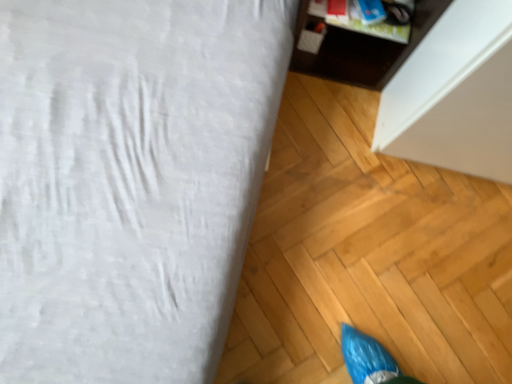
What do you see at coordinates (361, 48) in the screenshot? I see `dark wood cabinet at upper right, the 2th furniture when ordered from left to right` at bounding box center [361, 48].

From the picture: In order to face dark wood cabinet at upper right, which is the first furniture from right to left, should I rotate leftwards or rightwards?

It's best to rotate right around 14.298 degrees.

The image size is (512, 384). I want to click on dark wood cabinet at upper right, which is the first furniture from right to left, so click(x=361, y=48).

You are a GUI agent. You are given a task and a screenshot of the screen. Output one action in this format:
    pyautogui.click(x=<x>, y=<y>)
    Task: Click on the white fabric bed at upper left, the first furniture positioned from the left
    
    Given the screenshot: What is the action you would take?
    pyautogui.click(x=130, y=181)

What is the approximate height of white fabric bed at upper left, the first furniture positioned from the left?

10.29 inches.

The image size is (512, 384). What do you see at coordinates (130, 181) in the screenshot? I see `white fabric bed at upper left, which appears as the 2th furniture when viewed from the right` at bounding box center [130, 181].

How much space does white fabric bed at upper left, which appears as the 2th furniture when viewed from the right, occupy horizontally?

36.90 inches.

Where is `dark wood cabinet at upper right, which is the first furniture from right to left`? dark wood cabinet at upper right, which is the first furniture from right to left is located at coordinates (361, 48).

Is white fabric bed at upper left, which appears as the 2th furniture when viewed from the right, to the left or to the right of dark wood cabinet at upper right, which is the first furniture from right to left, in the image?

Based on their positions, white fabric bed at upper left, which appears as the 2th furniture when viewed from the right, is located to the left of dark wood cabinet at upper right, which is the first furniture from right to left.

Is the position of white fabric bed at upper left, which appears as the 2th furniture when viewed from the right, more distant than that of dark wood cabinet at upper right, the 2th furniture when ordered from left to right?

No, white fabric bed at upper left, which appears as the 2th furniture when viewed from the right, is in front of dark wood cabinet at upper right, the 2th furniture when ordered from left to right.

Considering the positions of point (179, 55) and point (348, 45), is point (179, 55) closer or farther from the camera than point (348, 45)?

Point (179, 55).

From the image's perspective, is white fabric bed at upper left, the first furniture positioned from the left, located above dark wood cabinet at upper right, which is the first furniture from right to left?

Actually, white fabric bed at upper left, the first furniture positioned from the left, appears below dark wood cabinet at upper right, which is the first furniture from right to left, in the image.

From a real-world perspective, is white fabric bed at upper left, which appears as the 2th furniture when viewed from the right, positioned under dark wood cabinet at upper right, which is the first furniture from right to left, based on gravity?

Yes, from a real-world perspective, white fabric bed at upper left, which appears as the 2th furniture when viewed from the right, is beneath dark wood cabinet at upper right, which is the first furniture from right to left.

Can you confirm if white fabric bed at upper left, the first furniture positioned from the left, is wider than dark wood cabinet at upper right, the 2th furniture when ordered from left to right?

Yes, white fabric bed at upper left, the first furniture positioned from the left, is wider than dark wood cabinet at upper right, the 2th furniture when ordered from left to right.

Is white fabric bed at upper left, which appears as the 2th furniture when viewed from the right, taller than dark wood cabinet at upper right, which is the first furniture from right to left?

No.

Between white fabric bed at upper left, which appears as the 2th furniture when viewed from the right, and dark wood cabinet at upper right, the 2th furniture when ordered from left to right, which one has larger size?

white fabric bed at upper left, which appears as the 2th furniture when viewed from the right.

Is white fabric bed at upper left, which appears as the 2th furniture when viewed from the right, outside of dark wood cabinet at upper right, which is the first furniture from right to left?

Indeed, white fabric bed at upper left, which appears as the 2th furniture when viewed from the right, is completely outside dark wood cabinet at upper right, which is the first furniture from right to left.

Is white fabric bed at upper left, which appears as the 2th furniture when viewed from the right, positioned far away from dark wood cabinet at upper right, the 2th furniture when ordered from left to right?

No.

Is white fabric bed at upper left, the first furniture positioned from the left, aimed at dark wood cabinet at upper right, the 2th furniture when ordered from left to right?

Yes, white fabric bed at upper left, the first furniture positioned from the left, faces towards dark wood cabinet at upper right, the 2th furniture when ordered from left to right.

Consider the image. How different are the orientations of white fabric bed at upper left, the first furniture positioned from the left, and dark wood cabinet at upper right, the 2th furniture when ordered from left to right, in degrees?

89.4 degrees separate the facing orientations of white fabric bed at upper left, the first furniture positioned from the left, and dark wood cabinet at upper right, the 2th furniture when ordered from left to right.

How far apart are white fabric bed at upper left, which appears as the 2th furniture when viewed from the right, and dark wood cabinet at upper right, which is the first furniture from right to left?

A distance of 20.07 inches exists between white fabric bed at upper left, which appears as the 2th furniture when viewed from the right, and dark wood cabinet at upper right, which is the first furniture from right to left.

Identify the location of furniture below the dark wood cabinet at upper right, the 2th furniture when ordered from left to right (from a real-world perspective). This screenshot has height=384, width=512. (130, 181).

Between dark wood cabinet at upper right, which is the first furniture from right to left, and white fabric bed at upper left, the first furniture positioned from the left, which one appears on the right side from the viewer's perspective?

Positioned to the right is dark wood cabinet at upper right, which is the first furniture from right to left.

Considering the positions of objects dark wood cabinet at upper right, the 2th furniture when ordered from left to right, and white fabric bed at upper left, which appears as the 2th furniture when viewed from the right, in the image provided, who is in front, dark wood cabinet at upper right, the 2th furniture when ordered from left to right, or white fabric bed at upper left, which appears as the 2th furniture when viewed from the right,?

Positioned in front is white fabric bed at upper left, which appears as the 2th furniture when viewed from the right.

Considering the positions of point (350, 44) and point (208, 1), is point (350, 44) closer or farther from the camera than point (208, 1)?

Point (350, 44).

From the image's perspective, would you say dark wood cabinet at upper right, which is the first furniture from right to left, is shown under white fabric bed at upper left, which appears as the 2th furniture when viewed from the right?

No, from the image's perspective, dark wood cabinet at upper right, which is the first furniture from right to left, is not below white fabric bed at upper left, which appears as the 2th furniture when viewed from the right.

From a real-world perspective, is dark wood cabinet at upper right, which is the first furniture from right to left, physically below white fabric bed at upper left, which appears as the 2th furniture when viewed from the right?

No.

In terms of width, does dark wood cabinet at upper right, which is the first furniture from right to left, look wider or thinner when compared to white fabric bed at upper left, the first furniture positioned from the left?

dark wood cabinet at upper right, which is the first furniture from right to left, is thinner than white fabric bed at upper left, the first furniture positioned from the left.

Is dark wood cabinet at upper right, the 2th furniture when ordered from left to right, taller or shorter than white fabric bed at upper left, the first furniture positioned from the left?

Clearly, dark wood cabinet at upper right, the 2th furniture when ordered from left to right, is taller compared to white fabric bed at upper left, the first furniture positioned from the left.

Between dark wood cabinet at upper right, the 2th furniture when ordered from left to right, and white fabric bed at upper left, which appears as the 2th furniture when viewed from the right, which one has smaller size?

dark wood cabinet at upper right, the 2th furniture when ordered from left to right, is smaller.

Would you say dark wood cabinet at upper right, which is the first furniture from right to left, is outside white fabric bed at upper left, the first furniture positioned from the left?

Absolutely, dark wood cabinet at upper right, which is the first furniture from right to left, is external to white fabric bed at upper left, the first furniture positioned from the left.

Is dark wood cabinet at upper right, which is the first furniture from right to left, positioned far away from white fabric bed at upper left, the first furniture positioned from the left?

dark wood cabinet at upper right, which is the first furniture from right to left, is near white fabric bed at upper left, the first furniture positioned from the left, not far away.

In the scene shown: Does dark wood cabinet at upper right, the 2th furniture when ordered from left to right, turn towards white fabric bed at upper left, the first furniture positioned from the left?

No, dark wood cabinet at upper right, the 2th furniture when ordered from left to right, does not turn towards white fabric bed at upper left, the first furniture positioned from the left.

Locate an element on the screen. Image resolution: width=512 pixels, height=384 pixels. furniture below the dark wood cabinet at upper right, which is the first furniture from right to left (from a real-world perspective) is located at coordinates (130, 181).

Locate an element on the screen. The width and height of the screenshot is (512, 384). furniture in front of the dark wood cabinet at upper right, which is the first furniture from right to left is located at coordinates (130, 181).

Locate an element on the screen. This screenshot has width=512, height=384. furniture on the left of dark wood cabinet at upper right, which is the first furniture from right to left is located at coordinates (130, 181).